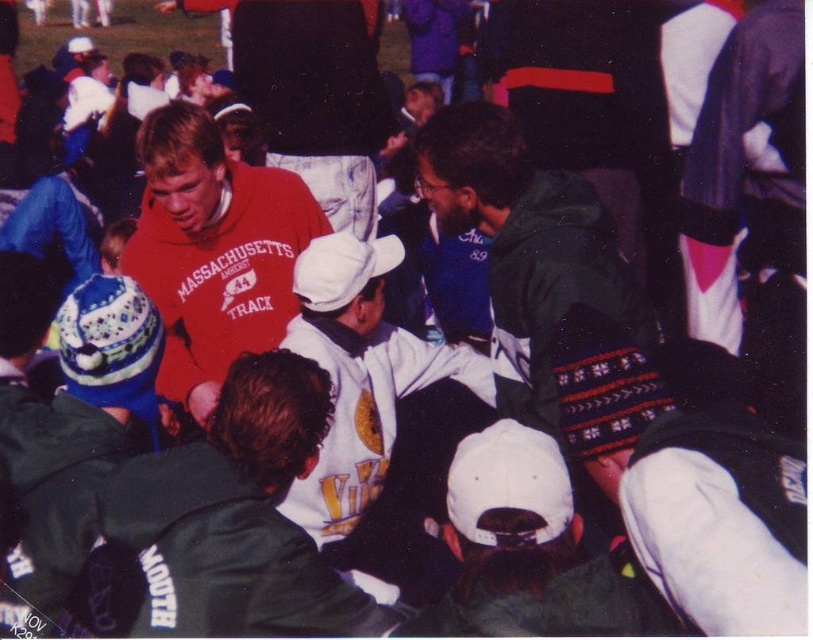
You are a photographer at the event and want to capture a photo of the matte red sweatshirt at center without including the knitted wool hat at center in the frame. Based on their positions, which direction should you move your camera to the left or right?

The knitted wool hat at center is to the right of the matte red sweatshirt at center. To avoid capturing the knitted wool hat at center, you should move your camera to the right so that the matte red sweatshirt at center remains in frame while the knitted wool hat at center moves out of the frame.

You are a photographer at the sports event and want to capture both the white fleece jacket at center and the matte red sweatshirt at center in the same frame. Which one should you focus on first to ensure both are in the frame?

The white fleece jacket at center is to the right of the matte red sweatshirt at center, so focusing on the matte red sweatshirt at center first would allow the photographer to include both in the frame by adjusting the camera to the right.